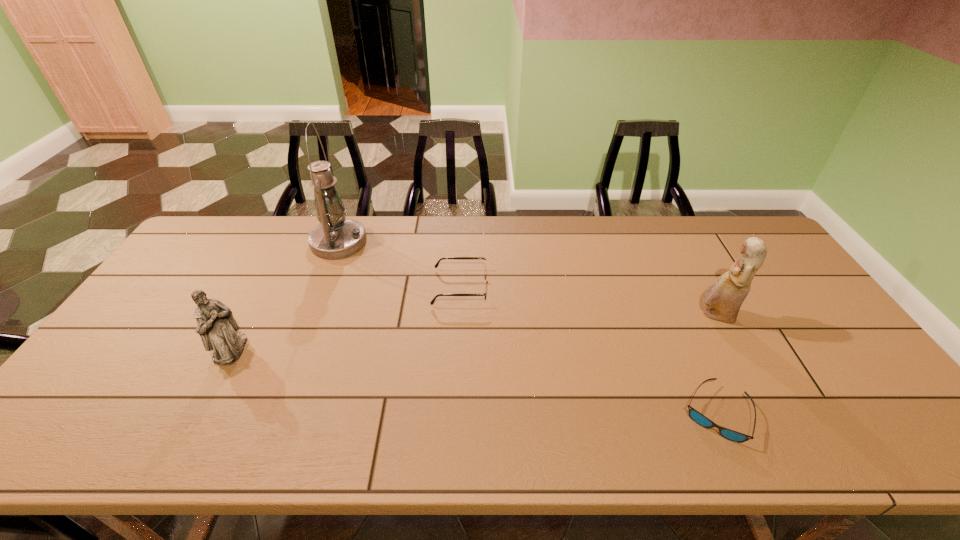
The image size is (960, 540). Find the location of `empty space that is in between the second tallest object and the leftmost object`. empty space that is in between the second tallest object and the leftmost object is located at coordinates (473, 333).

Identify the location of vacant area that lies between the nearest object and the second object from left to right. (527, 328).

Where is `object that is the third nearest to the farthest object`? Image resolution: width=960 pixels, height=540 pixels. object that is the third nearest to the farthest object is located at coordinates (697, 417).

Where is `object that is the closest to the tallest object`? object that is the closest to the tallest object is located at coordinates (486, 275).

I want to click on vacant area that satisfies the following two spatial constraints: 1. on the front-facing side of the farther figurine; 2. at the front of the shortest object showing the lenses, so click(768, 414).